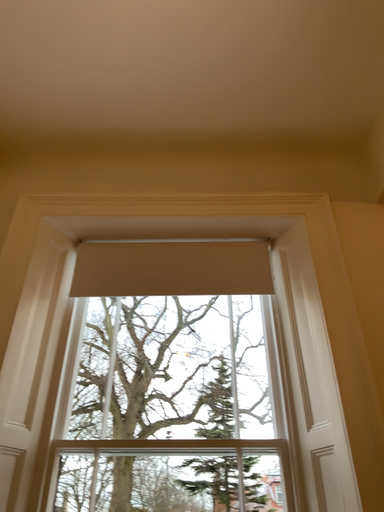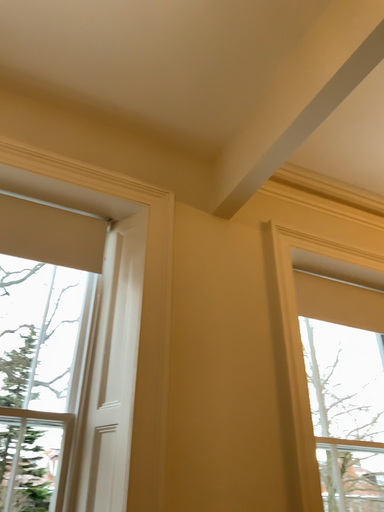
Question: Which way did the camera rotate in the video?

Choices:
 (A) rotated left
 (B) rotated right

Answer: (B)